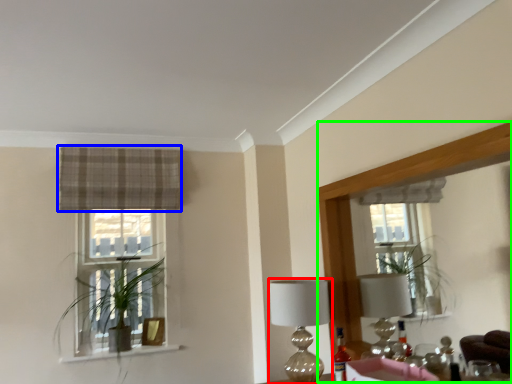
Question: Based on their relative distances, which object is nearer to table lamp (highlighted by a red box)? Choose from curtain (highlighted by a blue box) and mirror (highlighted by a green box).

Choices:
 (A) curtain
 (B) mirror

Answer: (B)